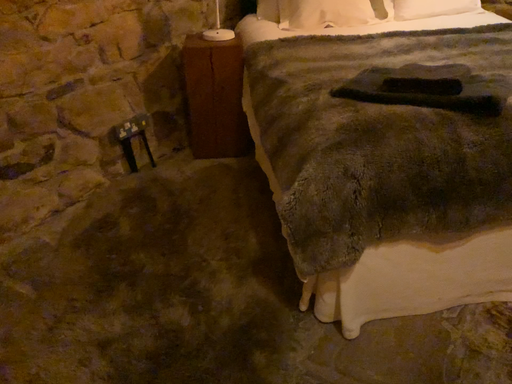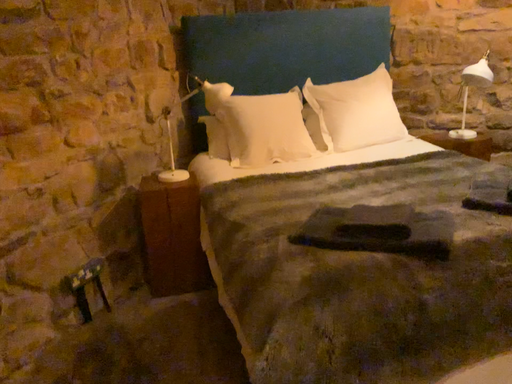
Question: Which way did the camera rotate in the video?

Choices:
 (A) rotated upward
 (B) rotated downward

Answer: (A)